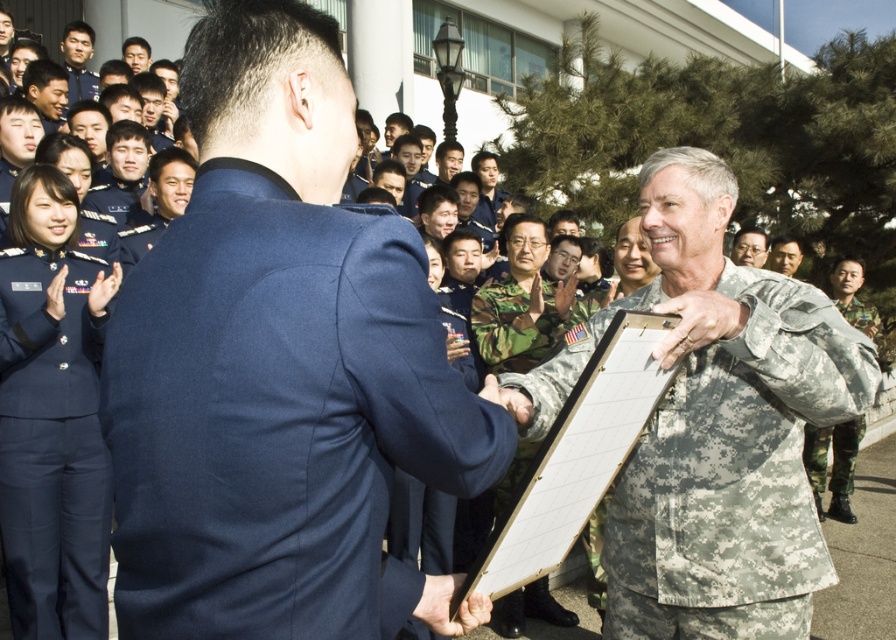
You are a photographer at this event and need to ensure both the camouflage fabric uniform at center and the matte gray uniform at center are clearly visible in your photo. Given their sizes, which uniform should you focus on first to avoid blurring due to movement?

The camouflage fabric uniform at center is bigger than the matte gray uniform at center, so you should focus on capturing the camouflage fabric uniform at center first since larger objects may require more precise framing to avoid motion blur.

You are a photographer at a military ceremony. You need to capture a photo of the blue woolen suit at center and the camouflage fabric uniform at center. According to their positions, which one is standing to the left of the other?

The blue woolen suit at center is positioned on the left side of camouflage fabric uniform at center, so the blue woolen suit at center is to the left of the camouflage fabric uniform at center.

From the picture: You are a photographer at a military ceremony. You need to capture a photo where both the camouflage fabric uniform at center and the matte gray uniform at center are clearly visible. Based on their positions, which uniform is positioned lower in the frame?

The camouflage fabric uniform at center is positioned below the matte gray uniform at center, so it is lower in the frame.